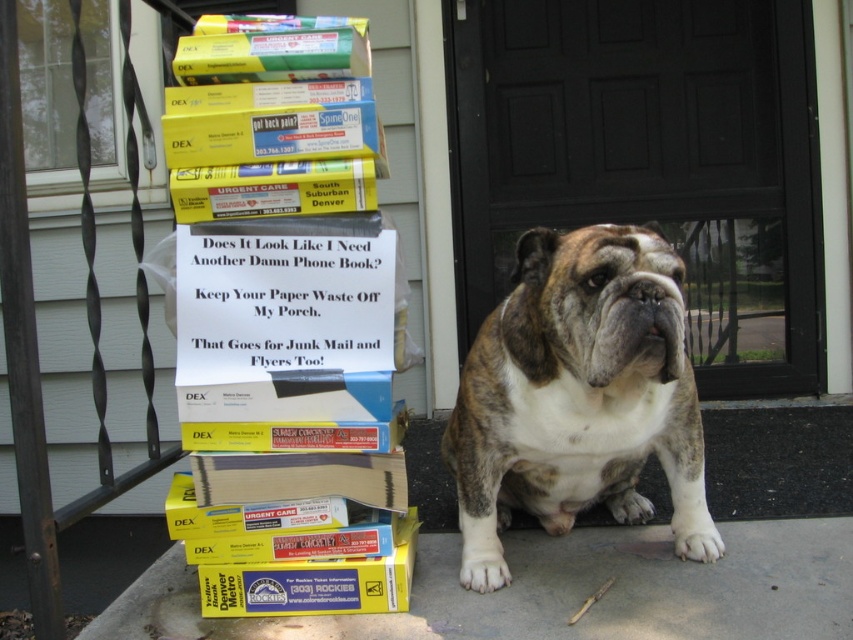
You are a delivery person approaching the house and see the yellow paper sign at center and the yellow matte box at lower left. Which object is nearer to you as you stand at the front of the porch?

The yellow paper sign at center is closer to the viewer than the yellow matte box at lower left, so the yellow paper sign at center is nearer to you.